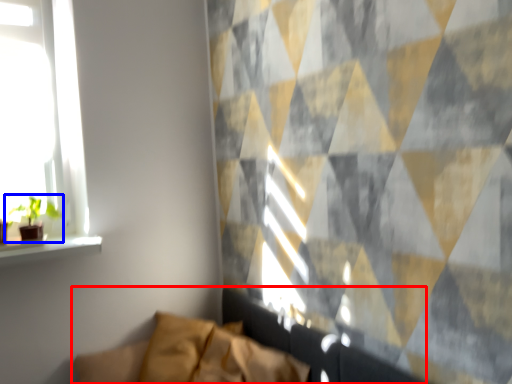
Question: Which of the following is the closest to the observer, couch (highlighted by a red box) or houseplant (highlighted by a blue box)?

Choices:
 (A) couch
 (B) houseplant

Answer: (A)